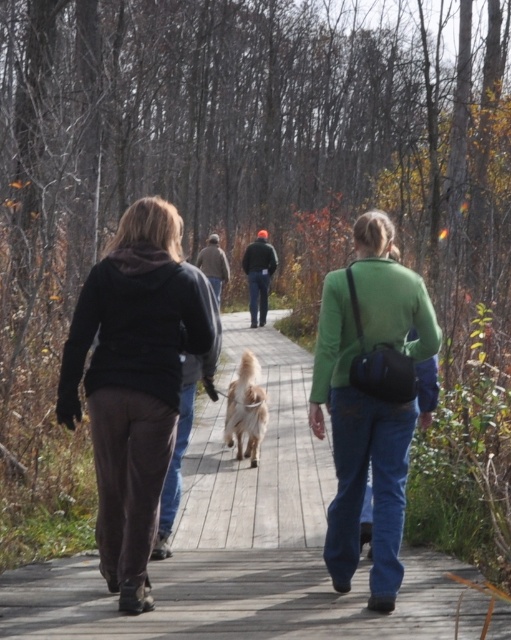
You are a photographer standing on the wooden boardwalk in the autumn forest scene. You want to take a photo that includes both the green matte jacket at center and the golden fur dog at center. Which object should you focus on first if you want to ensure both are in sharp focus?

The green matte jacket at center is much taller than the golden fur dog at center, so you should focus on the green matte jacket at center first to ensure both are in sharp focus.

You are standing at the edge of the forest and want to take a photo of the wooden boardwalk at center and the matte black hoodie at center. Which object should you focus on first to ensure both are in clear view?

Result: The wooden boardwalk at center is closer to the viewer than the matte black hoodie at center, so you should focus on the wooden boardwalk at center first to ensure both are in clear view.